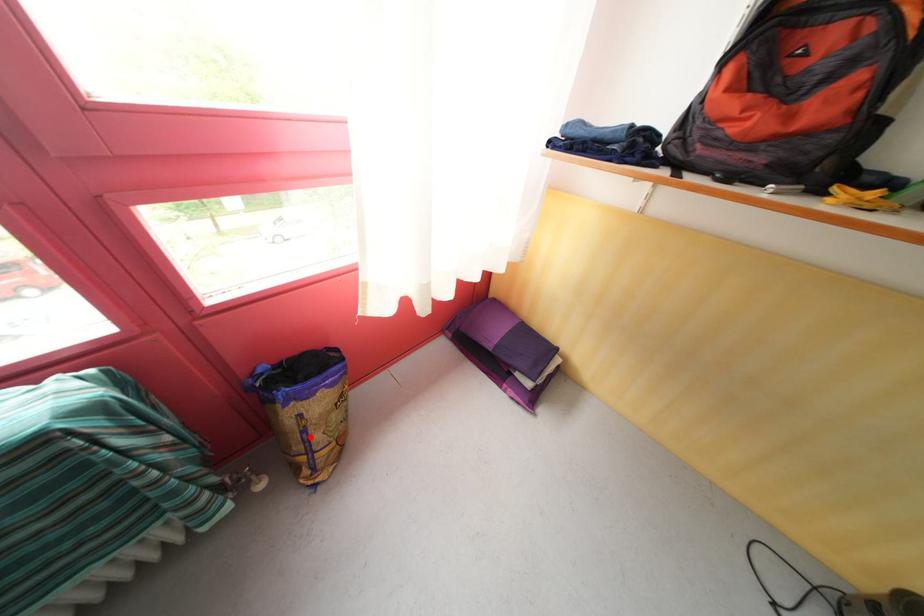
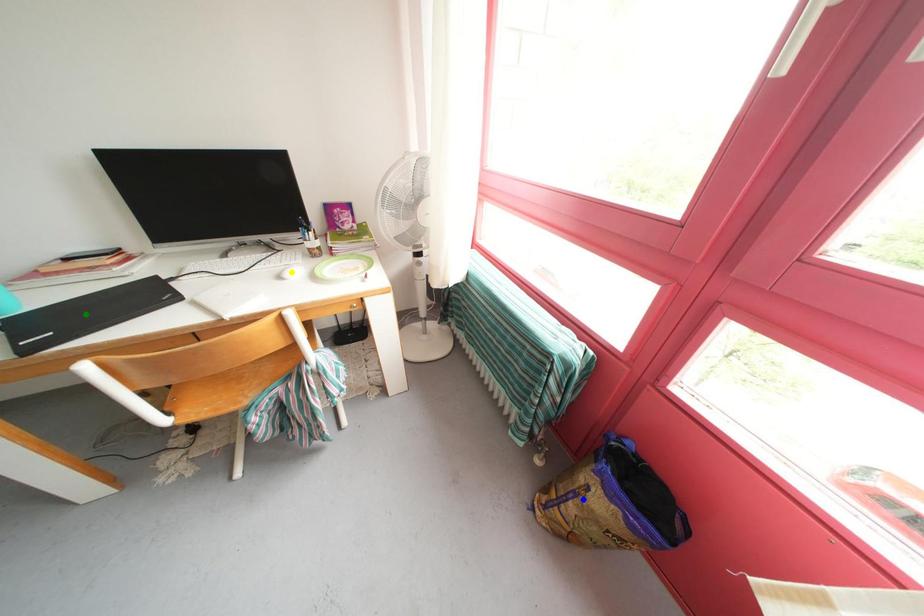
Question: I am providing you with two images of the same scene from different viewpoints. A red point is marked on the first image. You are given multiple points on the second image. Which point in image 2 represents the same 3d spot as the red point in image 1?

Choices:
 (A) green point
 (B) yellow point
 (C) blue point

Answer: (C)